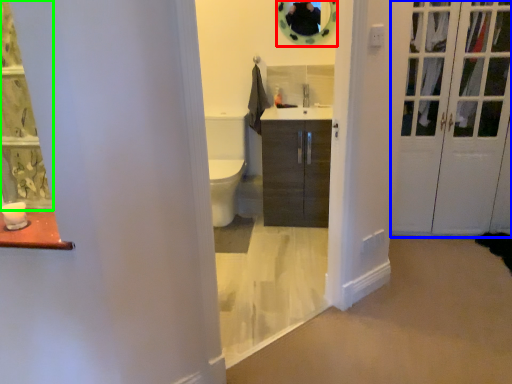
Question: Which object is positioned farthest from mirror (highlighted by a red box)? Select from door (highlighted by a blue box) and curtain (highlighted by a green box).

Choices:
 (A) door
 (B) curtain

Answer: (B)